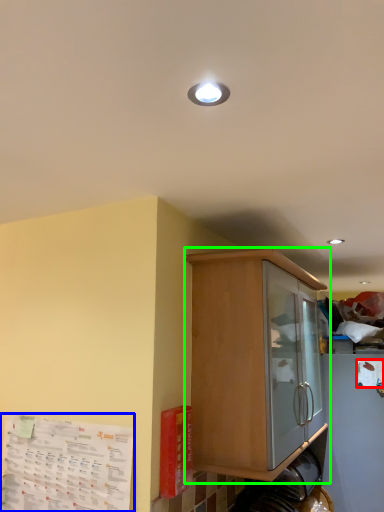
Question: Estimate the real-world distances between objects in this image. Which object is closer to paper (highlighted by a red box), paper (highlighted by a blue box) or cabinetry (highlighted by a green box)?

Choices:
 (A) paper
 (B) cabinetry

Answer: (B)